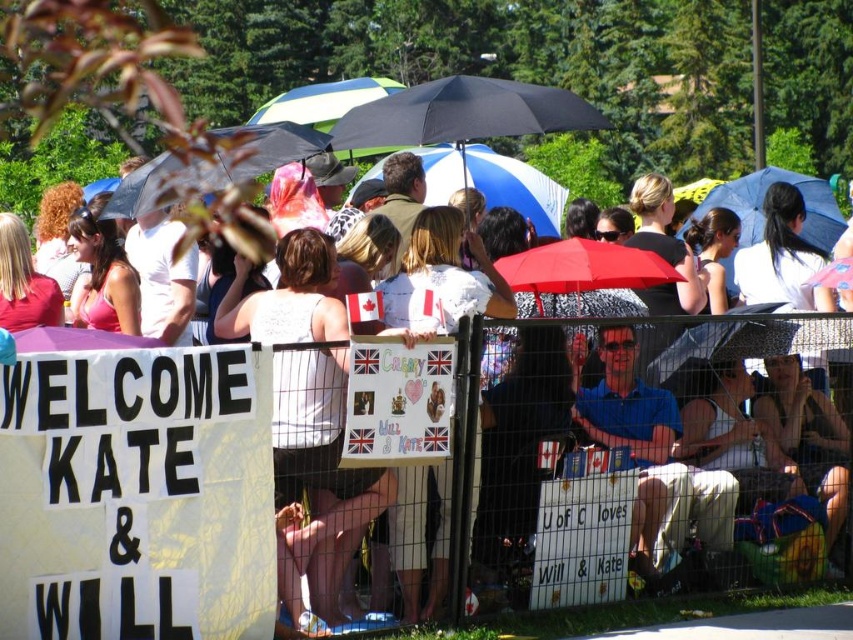
Question: Which of the following is the closest to the observer?

Choices:
 (A) (496, 480)
 (B) (260, 157)
 (C) (711, 204)

Answer: (A)

Question: Among these points, which one is nearest to the camera?

Choices:
 (A) (22, 448)
 (B) (451, 145)

Answer: (A)

Question: Is white paper sign at lower left positioned behind blue fabric umbrella at upper right?

Choices:
 (A) no
 (B) yes

Answer: (A)

Question: Does white paper sign at lower left have a larger size compared to blue and white striped umbrella at center?

Choices:
 (A) no
 (B) yes

Answer: (A)

Question: Is white paper sign at lower left to the right of blue and white striped umbrella at center from the viewer's perspective?

Choices:
 (A) no
 (B) yes

Answer: (A)

Question: Which point is farther to the camera?

Choices:
 (A) (828, 244)
 (B) (614, 532)

Answer: (A)